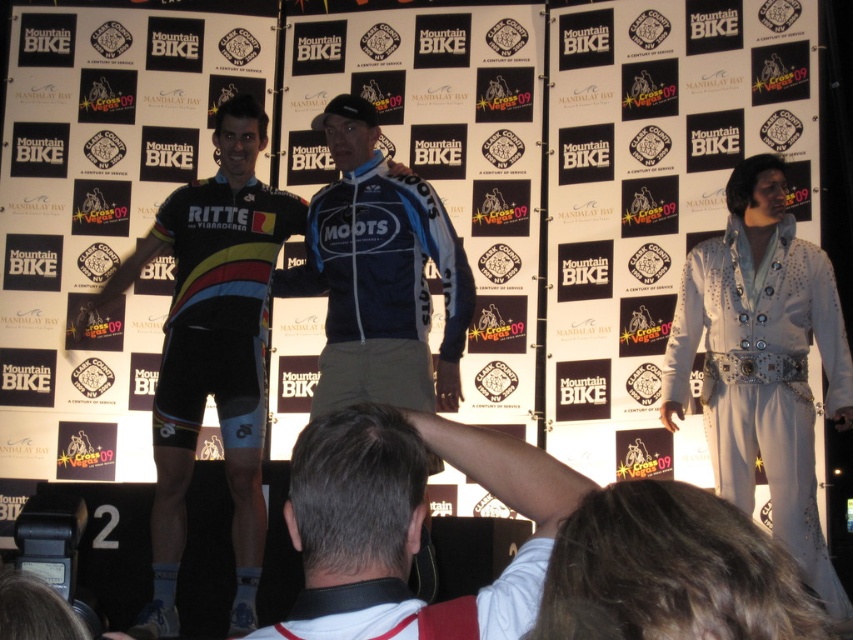
You are a photographer at this event. You need to take a photo that includes both the white satin suit at right and the white cotton shirt at center. Which one should you focus on if you want to highlight the larger object?

The white satin suit at right is bigger than the white cotton shirt at center, so you should focus on the white satin suit at right to highlight the larger object.

From the picture: You are a photographer at the Mountain Bike event and need to capture a photo of the two individuals wearing white. The white satin suit at right and the white cotton shirt at center are both in frame. Which one is positioned to the right of the other?

The white satin suit at right is positioned on the right side of white cotton shirt at center.

You are a photographer at the event and need to adjust your camera settings to capture both the white satin suit at right and the white cotton shirt at center clearly. Since both are white, you want to ensure the height difference between them is visible in the photo. Which one should you focus on to highlight its height advantage?

The white satin suit at right is taller than the white cotton shirt at center, so focusing on the white satin suit at right will highlight its greater height compared to the white cotton shirt at center.